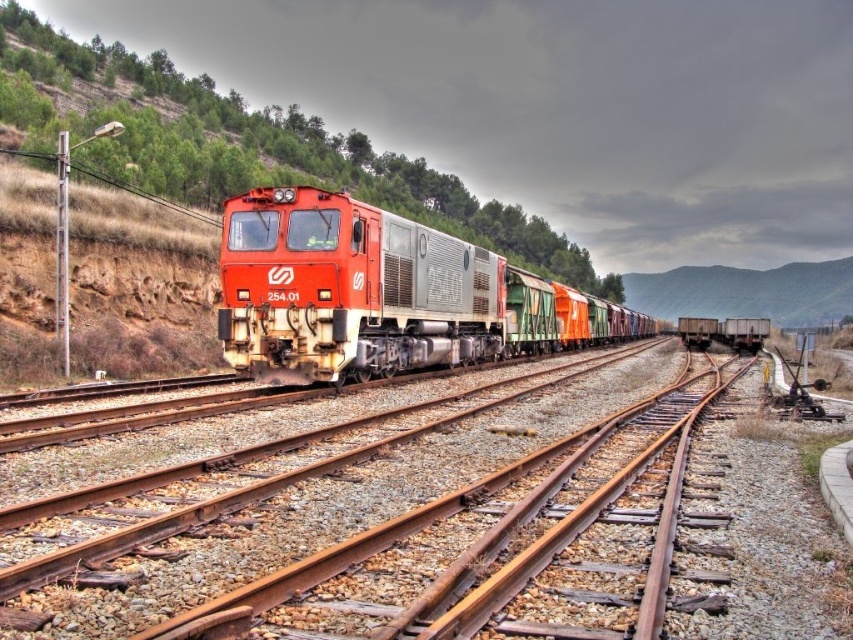
Question: Can you confirm if rusty metal tracks at center is positioned above matte red train at center?

Choices:
 (A) no
 (B) yes

Answer: (A)

Question: Which object is closer to the camera taking this photo?

Choices:
 (A) matte red train at center
 (B) green matte hillside at center

Answer: (A)

Question: Which object is the farthest from the matte red train at center?

Choices:
 (A) green matte hillside at center
 (B) rusty metal tracks at center

Answer: (A)

Question: Observing the image, what is the correct spatial positioning of rusty metal tracks at center in reference to matte red train at center?

Choices:
 (A) left
 (B) right

Answer: (B)

Question: Which object is positioned closest to the rusty metal tracks at center?

Choices:
 (A) matte red train at center
 (B) green matte hillside at center

Answer: (A)

Question: Does rusty metal tracks at center have a smaller size compared to matte red train at center?

Choices:
 (A) no
 (B) yes

Answer: (B)